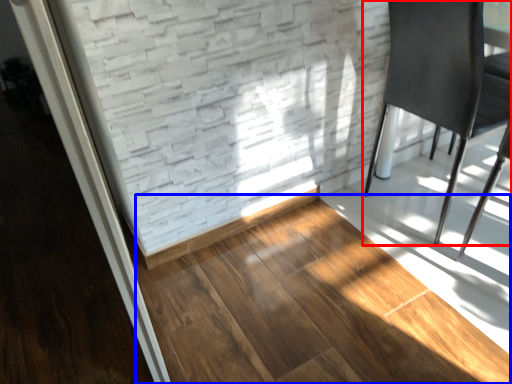
Question: Among these objects, which one is farthest to the camera, chair (highlighted by a red box) or hardwood (highlighted by a blue box)?

Choices:
 (A) chair
 (B) hardwood

Answer: (A)